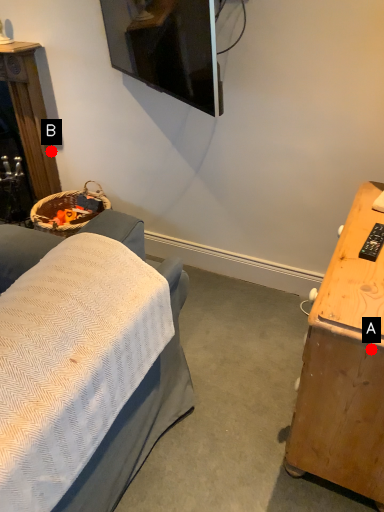
Question: Two points are circled on the image, labeled by A and B beside each circle. Which point is closer to the camera?

Choices:
 (A) A is closer
 (B) B is closer

Answer: (A)